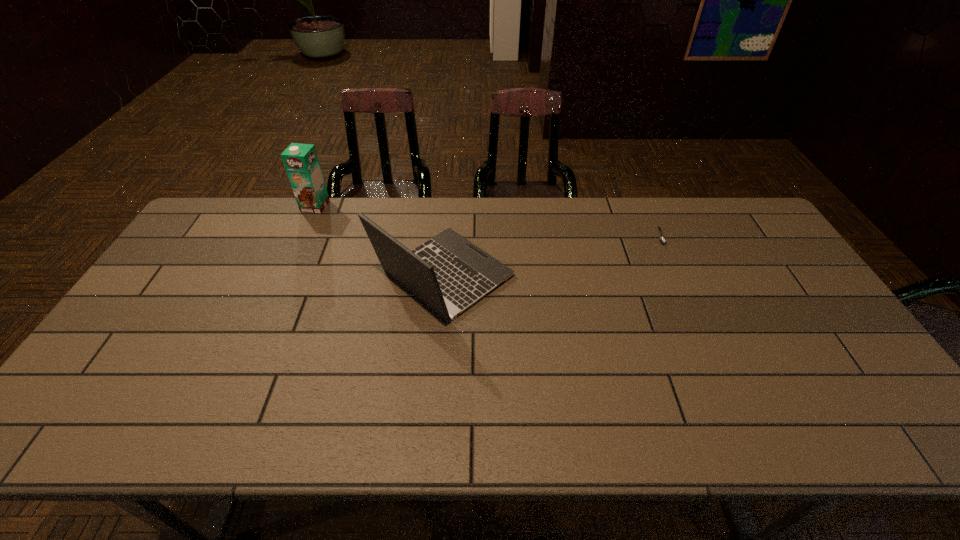
Identify the location of carton. This screenshot has width=960, height=540. (301, 162).

The image size is (960, 540). I want to click on the farthest object, so click(301, 162).

The height and width of the screenshot is (540, 960). Find the location of `the second object from left to right`. the second object from left to right is located at coordinates [448, 273].

Locate an element on the screen. Image resolution: width=960 pixels, height=540 pixels. the shortest object is located at coordinates (661, 239).

The height and width of the screenshot is (540, 960). In order to click on soupspoon in this screenshot , I will do `click(661, 239)`.

The width and height of the screenshot is (960, 540). In order to click on free space located 0.100m on the front of the carton in this screenshot , I will do `click(303, 232)`.

Locate an element on the screen. This screenshot has width=960, height=540. vacant area situated 0.300m at the front screen of the second object from right to left is located at coordinates (615, 276).

Locate an element on the screen. free region located 0.360m on the left of the rightmost object is located at coordinates (545, 236).

Find the location of a particular element. This screenshot has width=960, height=540. carton that is at the far edge is located at coordinates (301, 162).

Where is `laptop_computer at the far edge`? This screenshot has height=540, width=960. laptop_computer at the far edge is located at coordinates (448, 273).